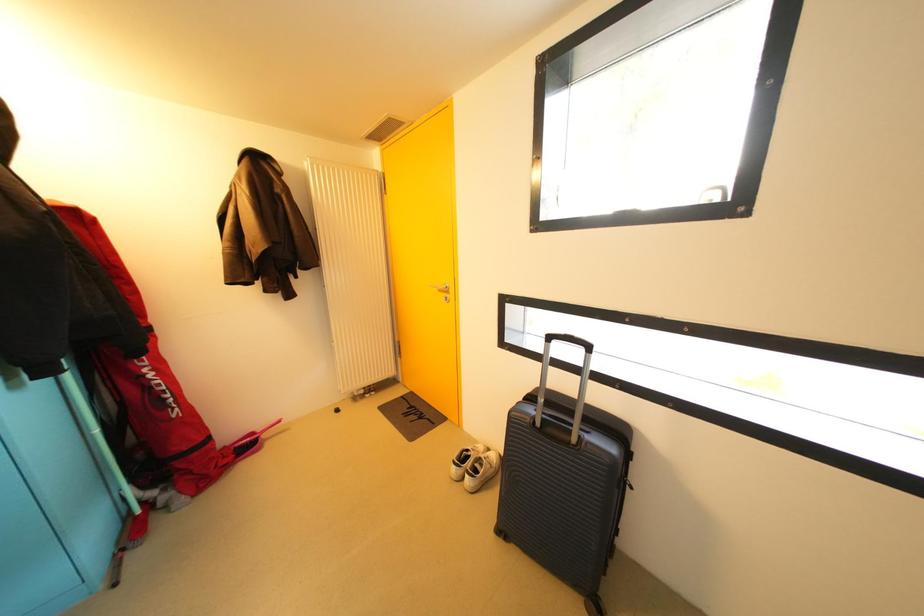
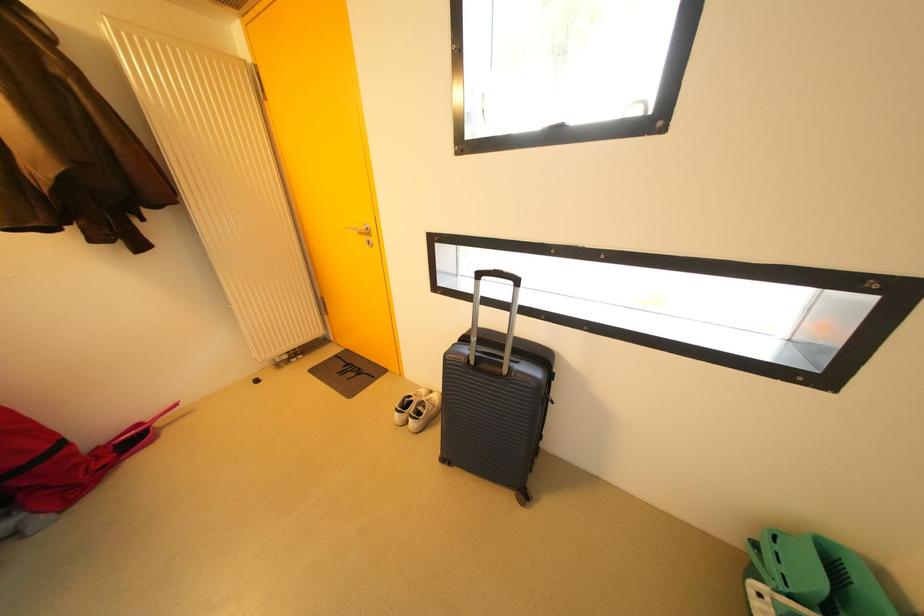
Question: The camera is either moving clockwise (left) or counter-clockwise (right) around the object. The first image is from the beginning of the video and the second image is from the end. Is the camera moving left or right when shooting the video?

Choices:
 (A) Left
 (B) Right

Answer: (A)